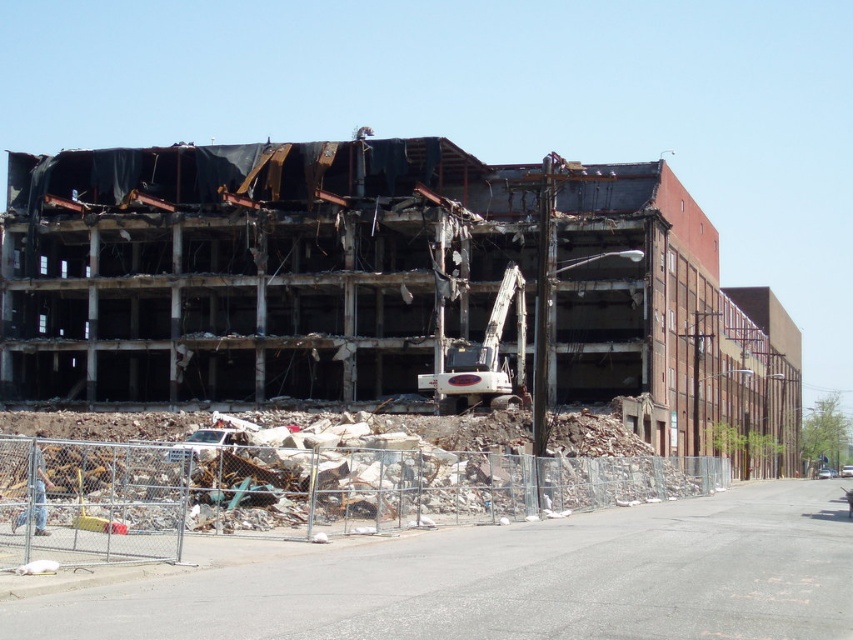
Between rusty metal building at center and white metallic excavator at center, which one is positioned higher?

white metallic excavator at center

Where is `rusty metal building at center`? The height and width of the screenshot is (640, 853). rusty metal building at center is located at coordinates (386, 285).

Between point (276, 317) and point (419, 380), which one is positioned behind?

Point (276, 317)

Identify the location of rusty metal building at center. (x=386, y=285).